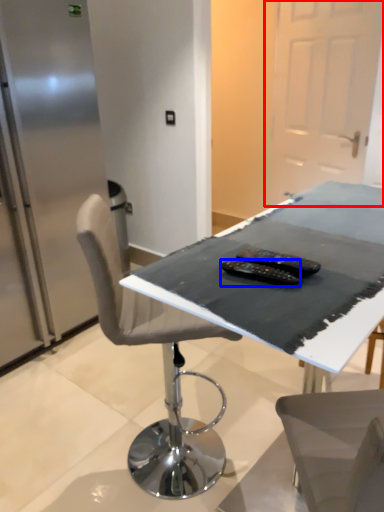
Question: Among these objects, which one is farthest to the camera, glass door (highlighted by a red box) or equipment (highlighted by a blue box)?

Choices:
 (A) glass door
 (B) equipment

Answer: (A)